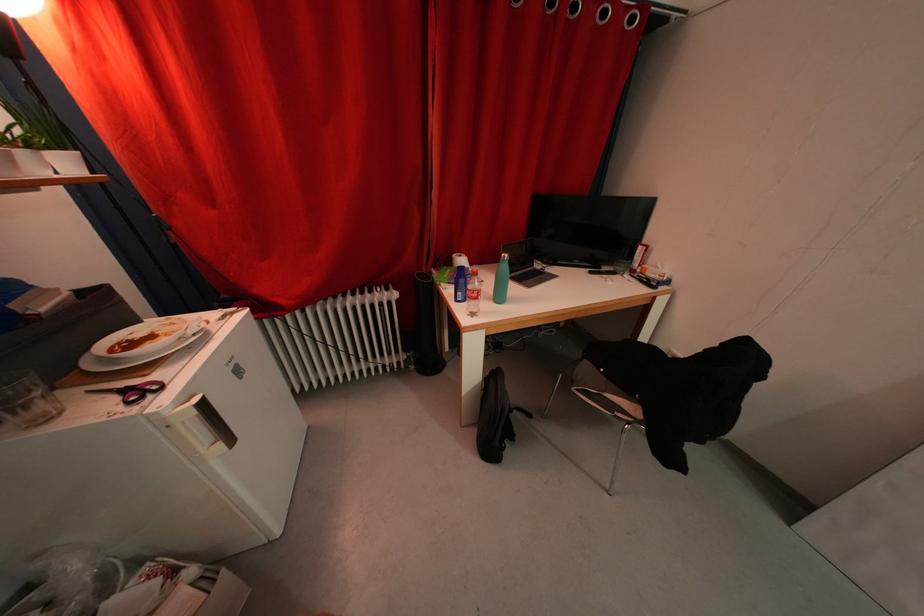
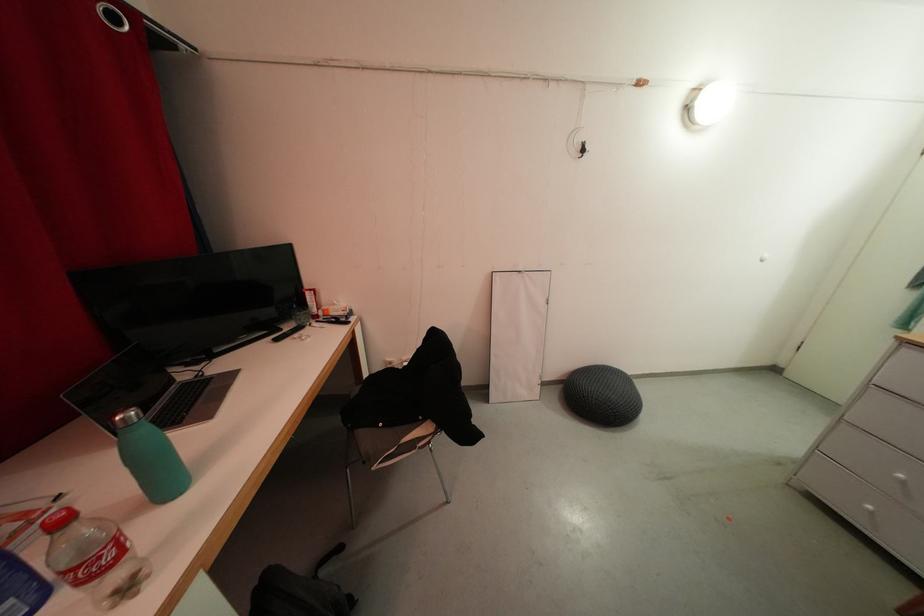
In the second image, find the point that corresponds to pixel 520 439 in the first image.

(357, 601)